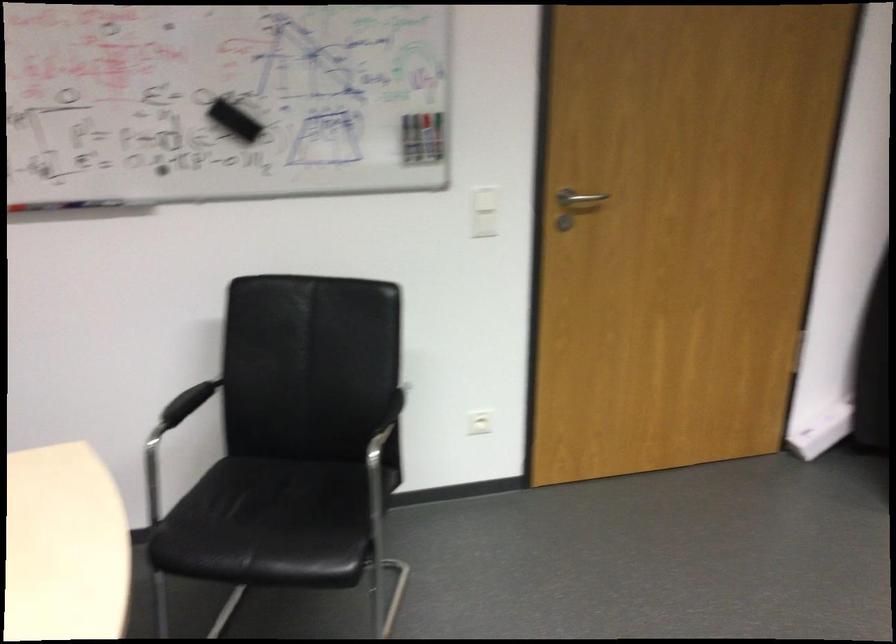
What do you see at coordinates (65, 203) in the screenshot? This screenshot has height=644, width=896. I see `the red whiteboard marker` at bounding box center [65, 203].